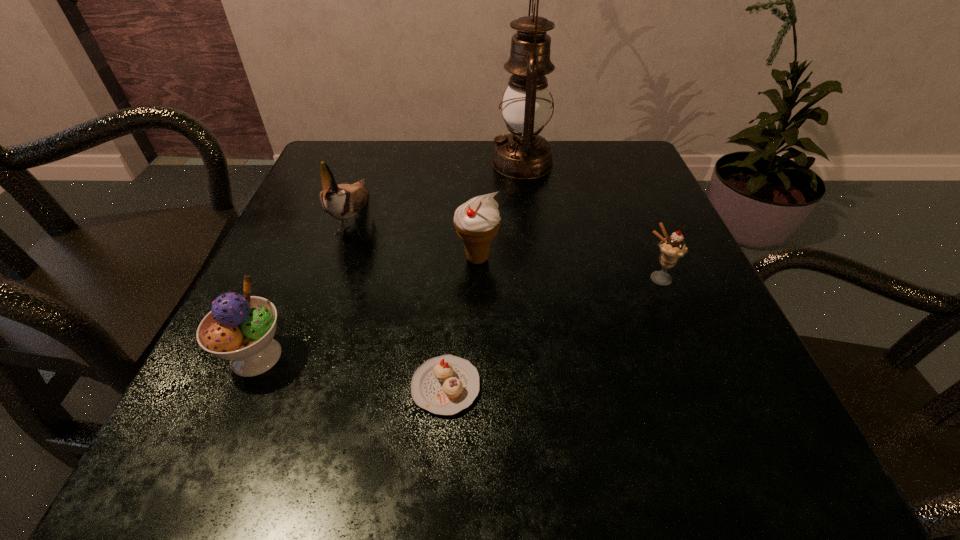
At what (x,y) coordinates should I click in order to perform the action: click on free space that satisfies the following two spatial constraints: 1. at the face of the rightmost object; 2. on the right side of the bird. Please return your answer as a coordinate pair (x, y). The width and height of the screenshot is (960, 540). Looking at the image, I should click on (333, 279).

Locate an element on the screen. The height and width of the screenshot is (540, 960). free space in the image that satisfies the following two spatial constraints: 1. at the face of the shortest object; 2. on the right side of the fifth shortest object is located at coordinates (296, 387).

At what (x,y) coordinates should I click in order to perform the action: click on vacant space that satisfies the following two spatial constraints: 1. at the face of the bird; 2. on the left side of the second icecream from left to right. Please return your answer as a coordinate pair (x, y). The image size is (960, 540). Looking at the image, I should click on (340, 258).

The width and height of the screenshot is (960, 540). Find the location of `free region that satisfies the following two spatial constraints: 1. at the face of the fifth shortest object; 2. on the left side of the tallest icecream`. free region that satisfies the following two spatial constraints: 1. at the face of the fifth shortest object; 2. on the left side of the tallest icecream is located at coordinates (340, 258).